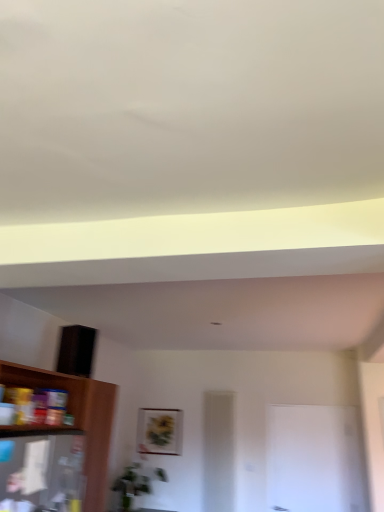
Question: Considering the positions of point (92, 444) and point (147, 417), is point (92, 444) closer or farther from the camera than point (147, 417)?

Choices:
 (A) farther
 (B) closer

Answer: (B)

Question: Is wooden shelf at lower left wider or thinner than matte gold picture frame at center?

Choices:
 (A) wide
 (B) thin

Answer: (A)

Question: Which object is the closest to the wooden shelf at lower left?

Choices:
 (A) white glossy door at center
 (B) matte gold picture frame at center

Answer: (B)

Question: Estimate the real-world distances between objects in this image. Which object is farther from the wooden shelf at lower left?

Choices:
 (A) white glossy door at center
 (B) matte gold picture frame at center

Answer: (A)